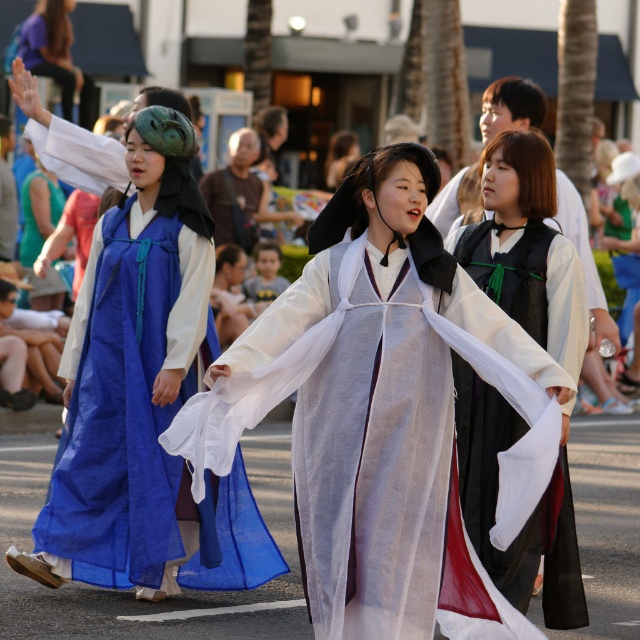
Who is higher up, blue silk dress at center or black satin robe at center?

black satin robe at center is above.

The height and width of the screenshot is (640, 640). What do you see at coordinates (145, 397) in the screenshot?
I see `blue silk dress at center` at bounding box center [145, 397].

The height and width of the screenshot is (640, 640). In order to click on blue silk dress at center in this screenshot , I will do `click(145, 397)`.

Can you confirm if silky white robe at center is positioned above blue silk dress at center?

Incorrect, silky white robe at center is not positioned above blue silk dress at center.

Between point (378, 406) and point (115, 330), which one is positioned behind?

Positioned behind is point (115, 330).

The width and height of the screenshot is (640, 640). Find the location of `silky white robe at center`. silky white robe at center is located at coordinates (384, 458).

Does black satin robe at center have a lesser height compared to light blue fabric at center?

Incorrect, black satin robe at center's height does not fall short of light blue fabric at center's.

Does black satin robe at center lie in front of light blue fabric at center?

Yes, black satin robe at center is in front of light blue fabric at center.

Is point (577, 273) positioned before point (272, 266)?

That is True.

You are a GUI agent. You are given a task and a screenshot of the screen. Output one action in this format:
    pyautogui.click(x=<x>, y=<y>)
    Task: Click on the black satin robe at center
    Image resolution: width=640 pixels, height=640 pixels.
    Given the screenshot: What is the action you would take?
    pyautogui.click(x=525, y=246)